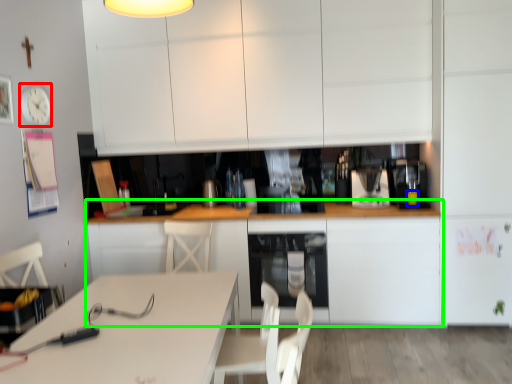
Question: Based on their relative distances, which object is farther from clock (highlighted by a red box)? Choose from beverage (highlighted by a blue box) and cabinetry (highlighted by a green box).

Choices:
 (A) beverage
 (B) cabinetry

Answer: (A)